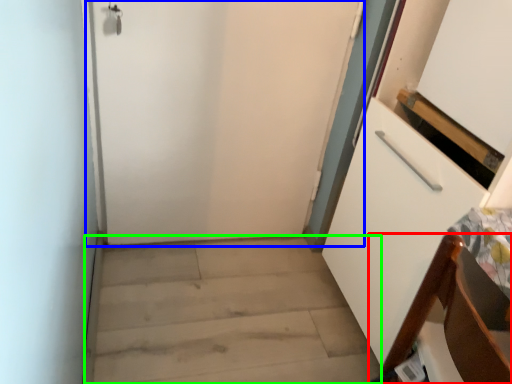
Question: Estimate the real-world distances between objects in this image. Which object is farther from furniture (highlighted by a red box), door (highlighted by a blue box) or stairwell (highlighted by a green box)?

Choices:
 (A) door
 (B) stairwell

Answer: (A)